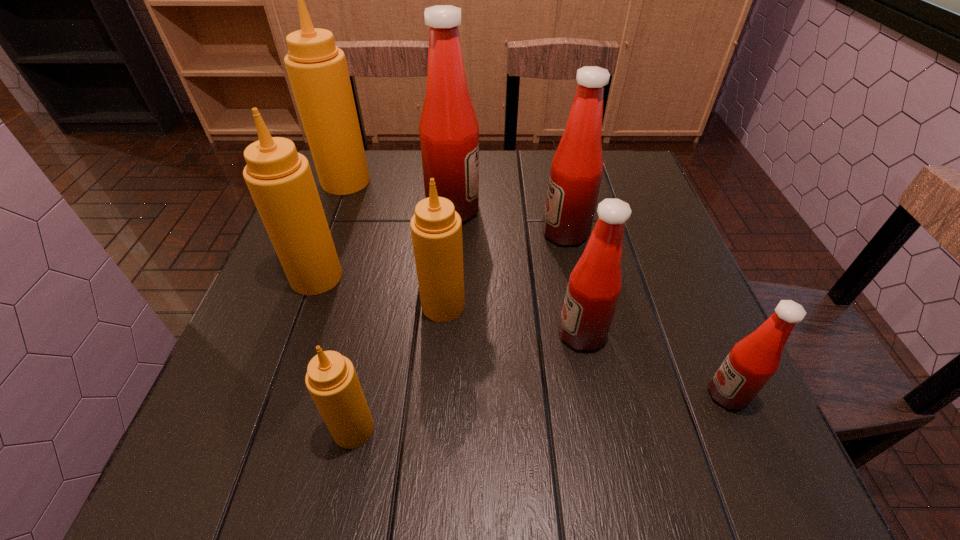
The width and height of the screenshot is (960, 540). What are the coordinates of `free space located 0.360m on the right of the farthest tan condiment` in the screenshot? It's located at (503, 181).

You are a GUI agent. You are given a task and a screenshot of the screen. Output one action in this format:
    pyautogui.click(x=<x>, y=<y>)
    Task: Click on the free space located 0.360m on the front-facing side of the leftmost red condiment
    Image resolution: width=960 pixels, height=540 pixels.
    Given the screenshot: What is the action you would take?
    pyautogui.click(x=623, y=210)

Locate an element on the screen. Image resolution: width=960 pixels, height=540 pixels. vacant area situated on the front-facing side of the third smallest red condiment is located at coordinates (416, 233).

Where is `free region located 0.080m on the front-facing side of the third smallest red condiment`? Image resolution: width=960 pixels, height=540 pixels. free region located 0.080m on the front-facing side of the third smallest red condiment is located at coordinates (509, 233).

At what (x,y) coordinates should I click in order to perform the action: click on vacant region located on the front-facing side of the third smallest red condiment. Please return your answer as a coordinate pair (x, y). This screenshot has width=960, height=540. Looking at the image, I should click on click(x=484, y=233).

Locate an element on the screen. The height and width of the screenshot is (540, 960). blank space located on the back of the third smallest tan condiment is located at coordinates (357, 163).

The height and width of the screenshot is (540, 960). I want to click on vacant point located on the left of the third biggest tan condiment, so click(352, 306).

Locate an element on the screen. The width and height of the screenshot is (960, 540). free spot located 0.290m on the front-facing side of the third biggest red condiment is located at coordinates (406, 334).

Identify the location of vacant position located 0.140m on the front-facing side of the third biggest red condiment. pyautogui.click(x=486, y=334).

This screenshot has width=960, height=540. Find the location of `vacant region located 0.130m on the front-facing side of the third biggest red condiment`. vacant region located 0.130m on the front-facing side of the third biggest red condiment is located at coordinates (491, 334).